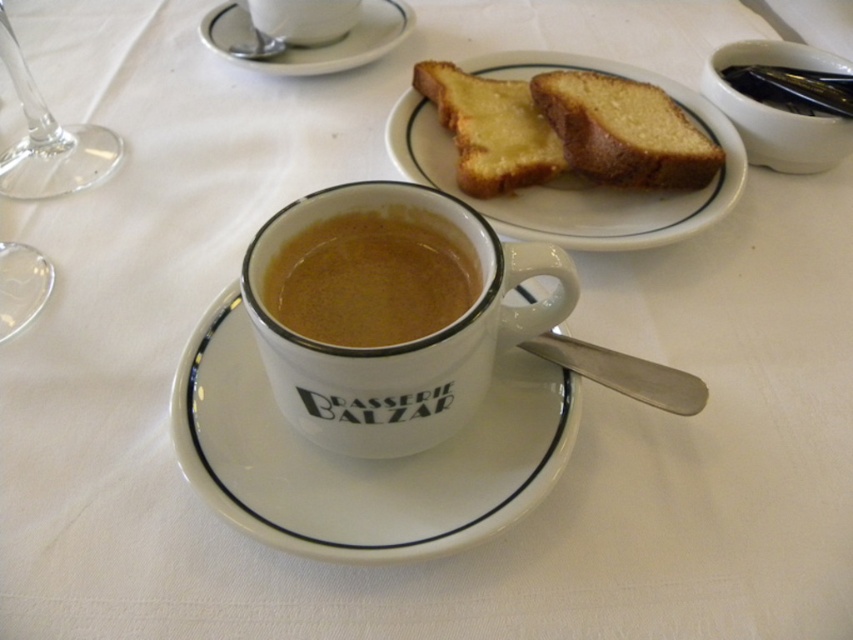
Does white ceramic saucer at center appear over yellowish-brown cake at upper center?

Actually, white ceramic saucer at center is below yellowish-brown cake at upper center.

Who is shorter, white ceramic saucer at center or yellowish-brown cake at upper center?

yellowish-brown cake at upper center

Which is in front, point (233, 408) or point (595, 129)?

Point (233, 408)

Image resolution: width=853 pixels, height=640 pixels. Find the location of `white ceramic saucer at center`. white ceramic saucer at center is located at coordinates (361, 460).

Does white ceramic mug at center appear over brown matte cup at center?

Incorrect, white ceramic mug at center is not positioned above brown matte cup at center.

Looking at this image, between white ceramic mug at center and brown matte cup at center, which one appears on the left side from the viewer's perspective?

Positioned to the left is brown matte cup at center.

Is point (421, 346) farther from viewer compared to point (352, 298)?

No, it is not.

Where is `white ceramic mug at center`? white ceramic mug at center is located at coordinates (401, 344).

Between white ceramic saucer at center and white ceramic saucer at upper center, which one has more height?

white ceramic saucer at upper center is taller.

Which is behind, point (527, 428) or point (282, 61)?

Positioned behind is point (282, 61).

Is point (247, 518) more distant than point (374, 19)?

No, (247, 518) is in front of (374, 19).

Locate an element on the screen. This screenshot has width=853, height=640. white ceramic saucer at center is located at coordinates (361, 460).